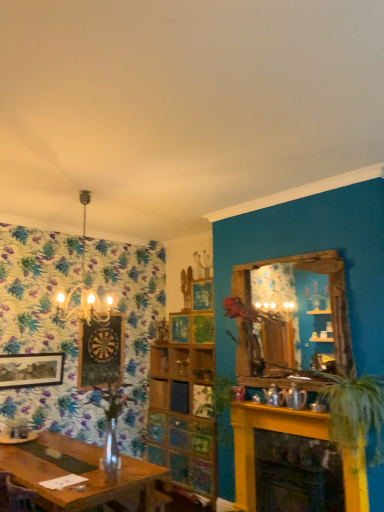
The height and width of the screenshot is (512, 384). I want to click on empty space that is ontop of yellow painted brick fireplace at lower right (from a real-world perspective), so (x=286, y=412).